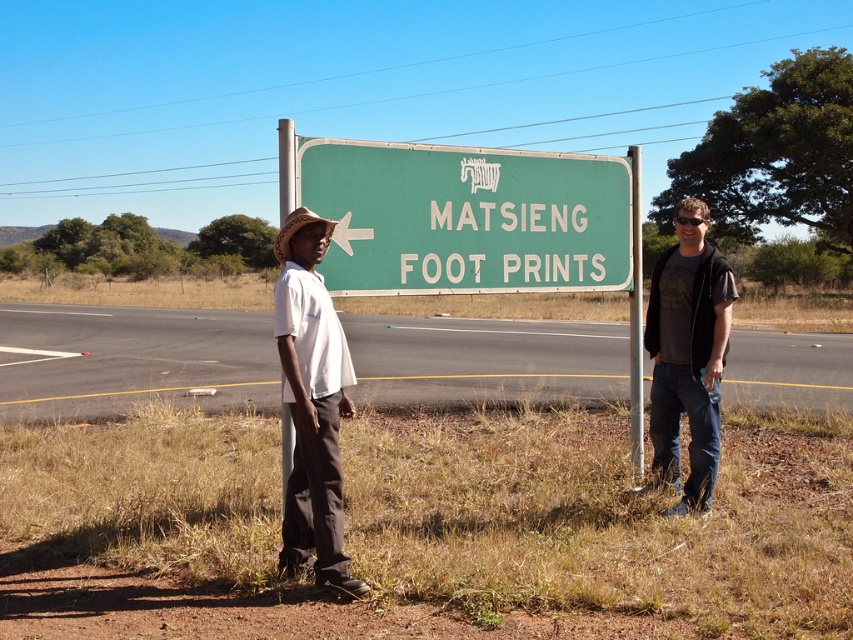
Is dark gray t-shirt at right thinner than green painted metal pole at center?

Yes, dark gray t-shirt at right is thinner than green painted metal pole at center.

Is point (701, 358) positioned before point (640, 282)?

Yes, point (701, 358) is in front of point (640, 282).

The image size is (853, 640). Identify the location of dark gray t-shirt at right. (688, 355).

Can you confirm if white cotton shirt at center is shorter than dark gray t-shirt at right?

Indeed, white cotton shirt at center has a lesser height compared to dark gray t-shirt at right.

Is white cotton shirt at center positioned before dark gray t-shirt at right?

Yes, white cotton shirt at center is in front of dark gray t-shirt at right.

Find the location of a particular element. The height and width of the screenshot is (640, 853). white cotton shirt at center is located at coordinates (312, 403).

Between green matte sign at center and white cotton shirt at center, which one appears on the left side from the viewer's perspective?

white cotton shirt at center is more to the left.

Who is positioned more to the right, green matte sign at center or white cotton shirt at center?

Positioned to the right is green matte sign at center.

You are a GUI agent. You are given a task and a screenshot of the screen. Output one action in this format:
    pyautogui.click(x=<x>, y=<y>)
    Task: Click on the green matte sign at center
    
    Given the screenshot: What is the action you would take?
    pyautogui.click(x=466, y=218)